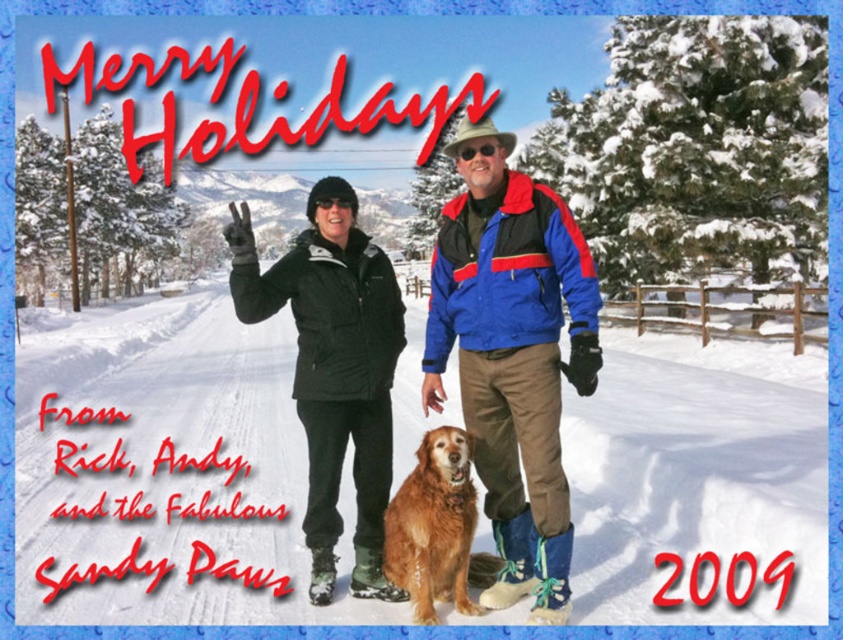
Question: Which of the following is the closest to the observer?

Choices:
 (A) (478, 364)
 (B) (458, 465)
 (C) (470, 150)
 (D) (337, 420)

Answer: (B)

Question: From the image, what is the correct spatial relationship of matte black jacket at center in relation to black nylon jacket at center?

Choices:
 (A) below
 (B) above

Answer: (B)

Question: Can you confirm if blue/red/black jacket at center is thinner than golden fur dog at center?

Choices:
 (A) yes
 (B) no

Answer: (B)

Question: Is black nylon jacket at center smaller than golden fur dog at center?

Choices:
 (A) yes
 (B) no

Answer: (A)

Question: Among these objects, which one is farthest from the camera?

Choices:
 (A) black nylon jacket at center
 (B) golden fur dog at center

Answer: (A)

Question: Which object is closer to the camera taking this photo?

Choices:
 (A) golden fur dog at center
 (B) matte black jacket at center
 (C) black nylon jacket at center

Answer: (B)